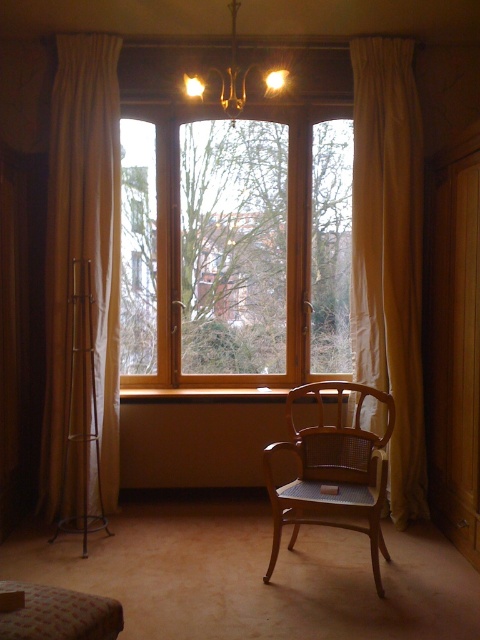
Is beige fabric curtain at left wider than beige fabric curtain at right?

Indeed, beige fabric curtain at left has a greater width compared to beige fabric curtain at right.

Is beige fabric curtain at left in front of beige fabric curtain at right?

No, it is not.

Identify the location of beige fabric curtain at left. (83, 248).

Is beige fabric curtain at left taller than wooden cane chair at center?

Yes, beige fabric curtain at left is taller than wooden cane chair at center.

Is beige fabric curtain at left positioned in front of wooden cane chair at center?

No, it is not.

Is point (43, 445) less distant than point (319, 381)?

That is False.

Identify the location of beige fabric curtain at left. The height and width of the screenshot is (640, 480). (83, 248).

Does point (166, 268) come in front of point (267, 445)?

No, (166, 268) is behind (267, 445).

Which is more to the left, wooden bay window at center or wooden cane chair at center?

Positioned to the left is wooden bay window at center.

Who is more forward, (x=256, y=189) or (x=308, y=522)?

Point (x=308, y=522) is in front.

The image size is (480, 640). What are the coordinates of `wooden bay window at center` in the screenshot? It's located at (235, 252).